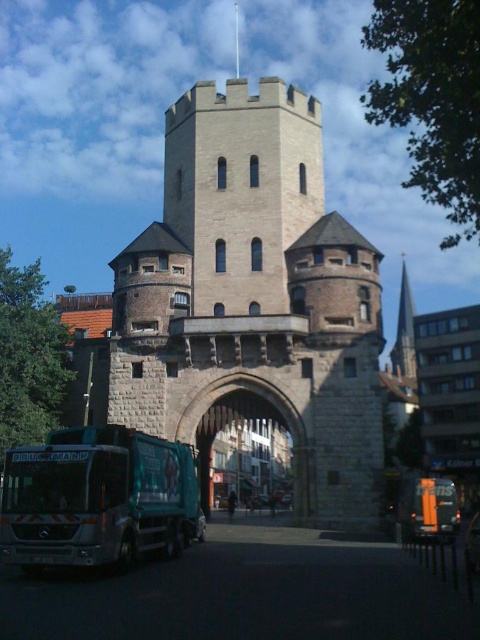
You are a city planner evaluating the space in front of the beige stone tower at center and the stone archway at center. Which structure occupies more horizontal space?

The beige stone tower at center is wider than the stone archway at center, so it occupies more horizontal space.

You are a tourist standing in front of the historic stone structure. You see the green metallic bus at lower left and the stone archway at center. Which object is positioned more to the left side of the scene?

The green metallic bus at lower left is positioned more to the left side of the scene than the stone archway at center.